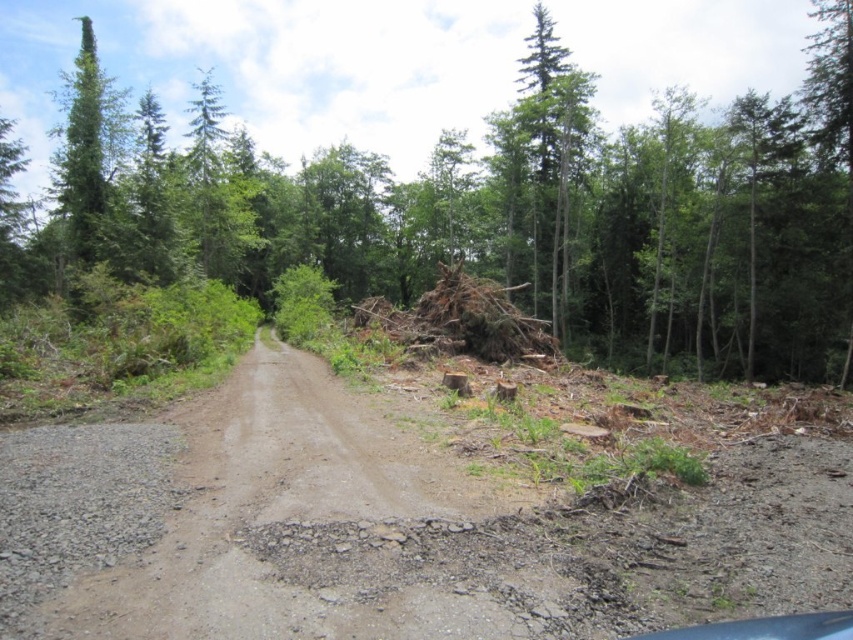
The width and height of the screenshot is (853, 640). I want to click on brown dirt track at center, so click(x=395, y=524).

Does brown dirt track at center have a larger size compared to brown wood pile at center?

No, brown dirt track at center is not bigger than brown wood pile at center.

Does point (527, 540) come behind point (335, 259)?

That is False.

At what (x,y) coordinates should I click in order to perform the action: click on brown dirt track at center. Please return your answer as a coordinate pair (x, y). Looking at the image, I should click on (395, 524).